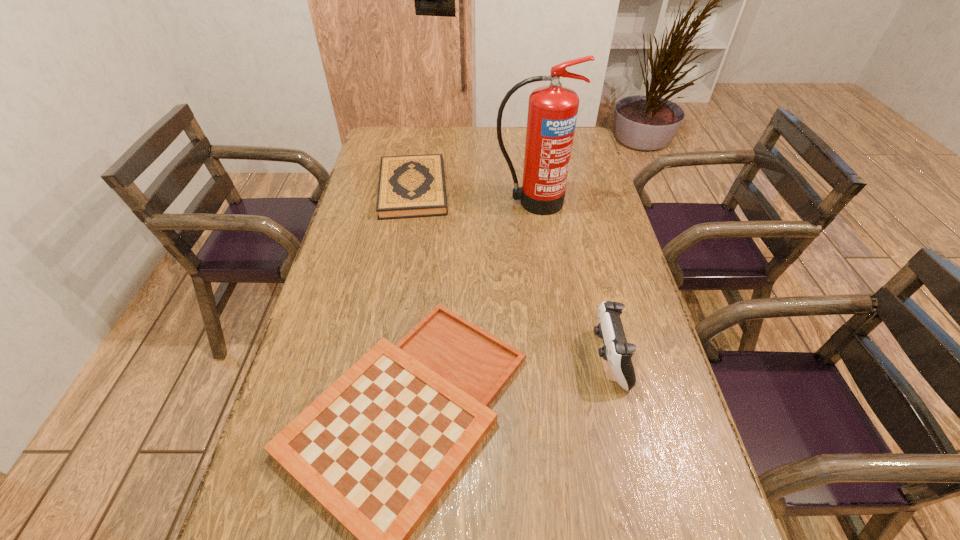
Where is `control positioned at the right edge`? This screenshot has width=960, height=540. control positioned at the right edge is located at coordinates (616, 351).

Identify the location of vacant space at the far edge of the desktop. The width and height of the screenshot is (960, 540). (426, 126).

In the image, there is a desktop. Where is `vacant space at the left edge`? The width and height of the screenshot is (960, 540). vacant space at the left edge is located at coordinates (370, 243).

Identify the location of vacant space at the right edge of the desktop. (604, 404).

Image resolution: width=960 pixels, height=540 pixels. In order to click on vacant position at the far right corner of the desktop in this screenshot , I will do `click(583, 156)`.

At what (x,y) coordinates should I click in order to perform the action: click on empty location between the tallest object and the control. Please return your answer as a coordinate pair (x, y). Image resolution: width=960 pixels, height=540 pixels. Looking at the image, I should click on (570, 280).

You are a GUI agent. You are given a task and a screenshot of the screen. Output one action in this format:
    pyautogui.click(x=<x>, y=<y>)
    Task: Click on the free space between the third tallest object and the third shortest object
    This screenshot has width=960, height=540.
    Given the screenshot: What is the action you would take?
    pyautogui.click(x=511, y=273)

Locate an element on the screen. vacant region between the third shortest object and the second shortest object is located at coordinates (511, 273).

At what (x,y) coordinates should I click in order to perform the action: click on free point between the hardback book and the control. Please return your answer as a coordinate pair (x, y). Looking at the image, I should click on (511, 273).

What are the coordinates of `vacant space that is in between the third shortest object and the hardback book` in the screenshot? It's located at (511, 273).